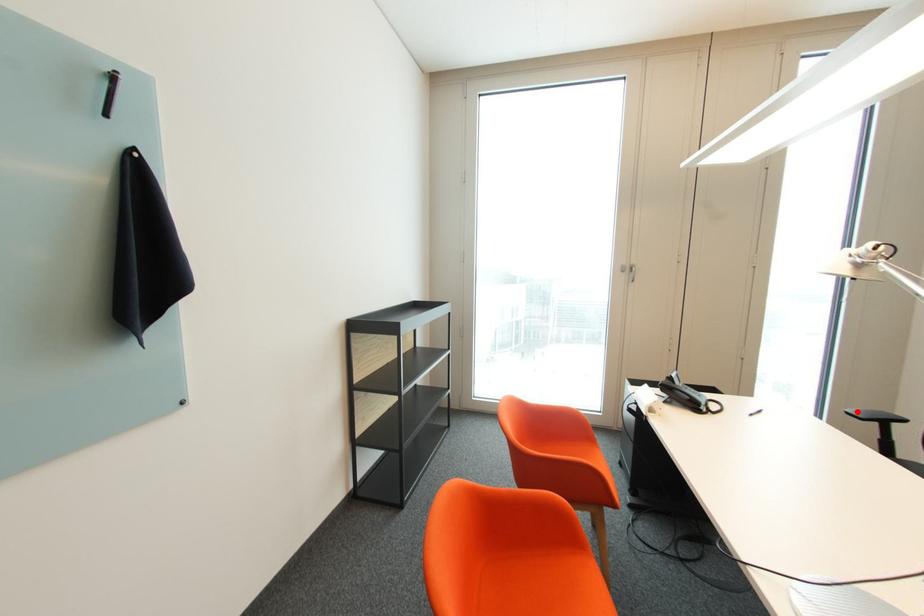
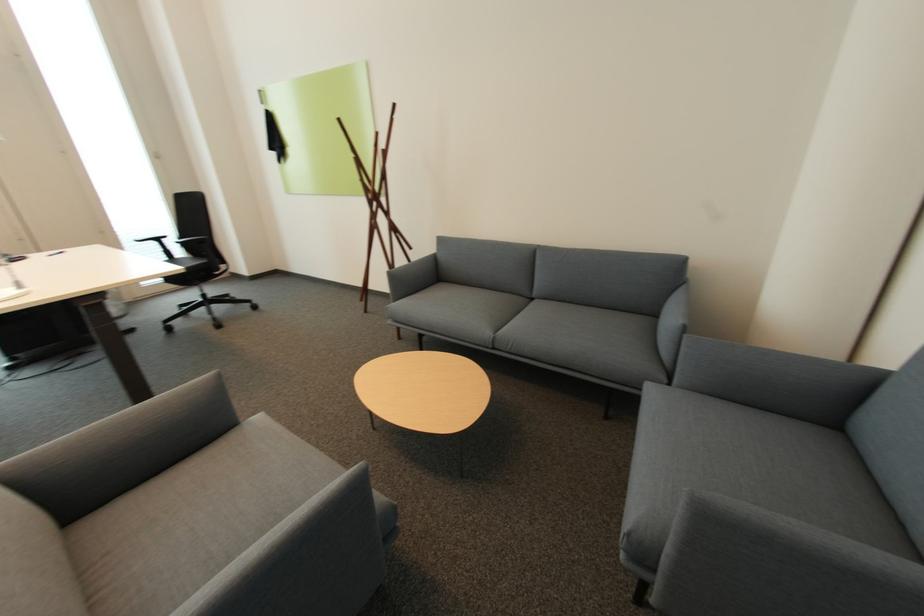
Locate, in the second image, the point that corresponds to the highlighted location in the first image.

(144, 238)